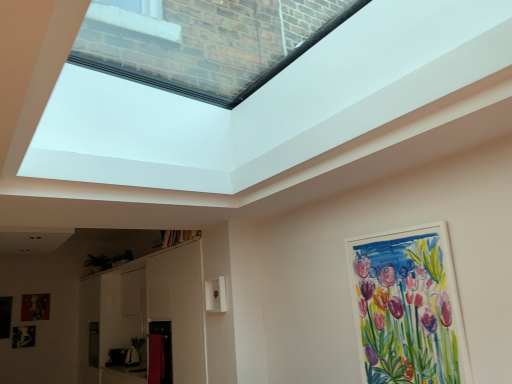
Question: Based on their sizes in the image, would you say white matte picture frame at upper right, marked as the third picture frame in a left-to-right arrangement, is bigger or smaller than black matte picture frame at lower left, which is counted as the 1th picture frame, starting from the bottom?

Choices:
 (A) big
 (B) small

Answer: (A)

Question: Do you think white matte picture frame at upper right, marked as the third picture frame in a bottom-to-top arrangement, is within black matte picture frame at lower left, placed as the second picture frame when sorted from back to front, or outside of it?

Choices:
 (A) inside
 (B) outside

Answer: (B)

Question: Estimate the real-world distances between objects in this image. Which object is closer to the black matte picture frame at lower left, placed as the second picture frame when sorted from back to front?

Choices:
 (A) white matte picture frame at upper right, marked as the third picture frame in a bottom-to-top arrangement
 (B) transparent glass skylight at upper center
 (C) matte wooden picture frame at lower left, which appears as the 2th picture frame when viewed from the right

Answer: (C)

Question: Which of these objects is positioned farthest from the matte wooden picture frame at lower left, which appears as the 2th picture frame when viewed from the right?

Choices:
 (A) white matte picture frame at upper right, which appears as the 1th picture frame when viewed from the right
 (B) black matte picture frame at lower left, placed as the second picture frame when sorted from back to front
 (C) transparent glass skylight at upper center

Answer: (A)